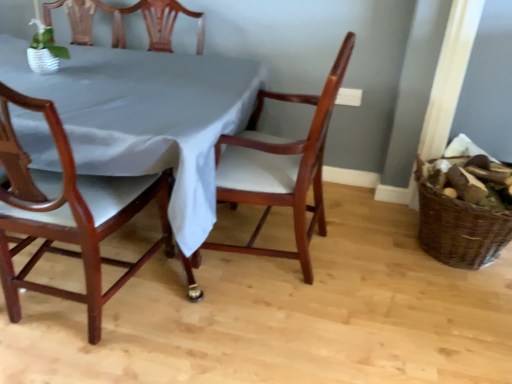
This screenshot has height=384, width=512. What do you see at coordinates (458, 227) in the screenshot? I see `brown woven basket at right` at bounding box center [458, 227].

Identify the location of brown woven basket at right. point(458,227).

Locate an element on the screen. chair that is behind the mahogany wood chair at left, positioned as the first chair in left-to-right order is located at coordinates (280, 167).

From a real-world perspective, is mahogany wood chair at left, the second chair in the right-to-left sequence, positioned above or below mahogany wood chair at center, the second chair when ordered from left to right?

In terms of real-world spatial position, mahogany wood chair at left, the second chair in the right-to-left sequence, is above mahogany wood chair at center, the second chair when ordered from left to right.

Is mahogany wood chair at left, positioned as the first chair in left-to-right order, looking in the opposite direction of mahogany wood chair at center, the 1th chair in the right-to-left sequence?

mahogany wood chair at left, positioned as the first chair in left-to-right order, is not turned away from mahogany wood chair at center, the 1th chair in the right-to-left sequence.

Considering the sizes of objects mahogany wood chair at left, positioned as the first chair in left-to-right order, and mahogany wood chair at center, the second chair when ordered from left to right, in the image provided, who is shorter, mahogany wood chair at left, positioned as the first chair in left-to-right order, or mahogany wood chair at center, the second chair when ordered from left to right,?

With less height is mahogany wood chair at center, the second chair when ordered from left to right.

Which is more to the left, satin white tablecloth at center or mahogany wood chair at center, the 1th chair in the right-to-left sequence?

satin white tablecloth at center is more to the left.

Is mahogany wood chair at center, the second chair when ordered from left to right, located within satin white tablecloth at center?

No.

Can you confirm if satin white tablecloth at center is bigger than mahogany wood chair at center, the second chair when ordered from left to right?

Indeed, satin white tablecloth at center has a larger size compared to mahogany wood chair at center, the second chair when ordered from left to right.

Considering the points (153, 142) and (264, 196), which point is behind, point (153, 142) or point (264, 196)?

Point (264, 196)

Is mahogany wood chair at center, the second chair when ordered from left to right, not near satin white tablecloth at center?

No, mahogany wood chair at center, the second chair when ordered from left to right, is not far from satin white tablecloth at center.

From a real-world perspective, is mahogany wood chair at center, the second chair when ordered from left to right, positioned above or below satin white tablecloth at center?

In terms of real-world spatial position, mahogany wood chair at center, the second chair when ordered from left to right, is above satin white tablecloth at center.

Does mahogany wood chair at center, the 1th chair in the right-to-left sequence, come in front of satin white tablecloth at center?

No, mahogany wood chair at center, the 1th chair in the right-to-left sequence, is further to the viewer.

From the image's perspective, which is above, mahogany wood chair at left, the second chair in the right-to-left sequence, or satin white tablecloth at center?

satin white tablecloth at center, from the image's perspective.

Which of these two, mahogany wood chair at left, the second chair in the right-to-left sequence, or satin white tablecloth at center, is wider?

satin white tablecloth at center.

Can you confirm if mahogany wood chair at left, the second chair in the right-to-left sequence, is positioned to the left of satin white tablecloth at center?

No.

Would you say mahogany wood chair at center, the 1th chair in the right-to-left sequence, is to the left or to the right of mahogany wood chair at left, positioned as the first chair in left-to-right order, in the picture?

mahogany wood chair at center, the 1th chair in the right-to-left sequence, is to the right of mahogany wood chair at left, positioned as the first chair in left-to-right order.

From the image's perspective, is mahogany wood chair at center, the 1th chair in the right-to-left sequence, under mahogany wood chair at left, positioned as the first chair in left-to-right order?

Actually, mahogany wood chair at center, the 1th chair in the right-to-left sequence, appears above mahogany wood chair at left, positioned as the first chair in left-to-right order, in the image.

How many degrees apart are the facing directions of mahogany wood chair at center, the 1th chair in the right-to-left sequence, and mahogany wood chair at left, positioned as the first chair in left-to-right order?

90 degrees separate the facing orientations of mahogany wood chair at center, the 1th chair in the right-to-left sequence, and mahogany wood chair at left, positioned as the first chair in left-to-right order.

Could you tell me if mahogany wood chair at center, the second chair when ordered from left to right, is turned towards mahogany wood chair at left, the second chair in the right-to-left sequence?

No.

How many degrees apart are the facing directions of satin white tablecloth at center and mahogany wood chair at left, the second chair in the right-to-left sequence?

There is a 179-degree angle between the facing directions of satin white tablecloth at center and mahogany wood chair at left, the second chair in the right-to-left sequence.

From the image's perspective, which one is positioned higher, satin white tablecloth at center or mahogany wood chair at left, the second chair in the right-to-left sequence?

From the image's view, satin white tablecloth at center is above.

Considering the points (150, 68) and (61, 126), which point is behind, point (150, 68) or point (61, 126)?

Positioned behind is point (150, 68).

Who is taller, satin white tablecloth at center or mahogany wood chair at left, the second chair in the right-to-left sequence?

With more height is mahogany wood chair at left, the second chair in the right-to-left sequence.

Does point (265, 253) lie behind point (505, 216)?

Yes.

Considering the relative sizes of mahogany wood chair at center, the second chair when ordered from left to right, and brown woven basket at right in the image provided, is mahogany wood chair at center, the second chair when ordered from left to right, thinner than brown woven basket at right?

No, mahogany wood chair at center, the second chair when ordered from left to right, is not thinner than brown woven basket at right.

Identify the location of the 1st chair directly above the brown woven basket at right (from a real-world perspective). The height and width of the screenshot is (384, 512). (280, 167).

Consider the image. Is mahogany wood chair at center, the 1th chair in the right-to-left sequence, taller than brown woven basket at right?

Yes, mahogany wood chair at center, the 1th chair in the right-to-left sequence, is taller than brown woven basket at right.

I want to click on chair in front of the mahogany wood chair at center, the 1th chair in the right-to-left sequence, so click(x=67, y=213).

Find the location of `the 1st chair positioned above the satin white tablecloth at center (from a real-world perspective)`. the 1st chair positioned above the satin white tablecloth at center (from a real-world perspective) is located at coordinates (280, 167).

Based on the photo, when comparing their distances from mahogany wood chair at left, the second chair in the right-to-left sequence, does mahogany wood chair at center, the 1th chair in the right-to-left sequence, or brown woven basket at right seem closer?

Based on the image, mahogany wood chair at center, the 1th chair in the right-to-left sequence, appears to be nearer to mahogany wood chair at left, the second chair in the right-to-left sequence.

From the image, which object appears to be farther from mahogany wood chair at center, the 1th chair in the right-to-left sequence, mahogany wood chair at left, positioned as the first chair in left-to-right order, or brown woven basket at right?

brown woven basket at right lies further to mahogany wood chair at center, the 1th chair in the right-to-left sequence, than the other object.

Estimate the real-world distances between objects in this image. Which object is further from brown woven basket at right, mahogany wood chair at left, the second chair in the right-to-left sequence, or mahogany wood chair at center, the second chair when ordered from left to right?

The object further to brown woven basket at right is mahogany wood chair at left, the second chair in the right-to-left sequence.

Based on their spatial positions, is mahogany wood chair at left, positioned as the first chair in left-to-right order, or mahogany wood chair at center, the second chair when ordered from left to right, further from satin white tablecloth at center?

mahogany wood chair at center, the second chair when ordered from left to right.

Estimate the real-world distances between objects in this image. Which object is closer to mahogany wood chair at left, positioned as the first chair in left-to-right order, satin white tablecloth at center or mahogany wood chair at center, the second chair when ordered from left to right?

satin white tablecloth at center.

From the image, which object appears to be farther from mahogany wood chair at left, positioned as the first chair in left-to-right order, mahogany wood chair at center, the second chair when ordered from left to right, or satin white tablecloth at center?

Among the two, mahogany wood chair at center, the second chair when ordered from left to right, is located further to mahogany wood chair at left, positioned as the first chair in left-to-right order.

From the image, which object appears to be nearer to mahogany wood chair at left, the second chair in the right-to-left sequence, satin white tablecloth at center or brown woven basket at right?

Among the two, satin white tablecloth at center is located nearer to mahogany wood chair at left, the second chair in the right-to-left sequence.

Based on their spatial positions, is mahogany wood chair at center, the 1th chair in the right-to-left sequence, or satin white tablecloth at center closer to brown woven basket at right?

mahogany wood chair at center, the 1th chair in the right-to-left sequence, lies closer to brown woven basket at right than the other object.

The image size is (512, 384). Find the location of `chair situated between satin white tablecloth at center and mahogany wood chair at center, the 1th chair in the right-to-left sequence, from left to right`. chair situated between satin white tablecloth at center and mahogany wood chair at center, the 1th chair in the right-to-left sequence, from left to right is located at coordinates (67, 213).

Find the location of a particular element. chair between mahogany wood chair at left, positioned as the first chair in left-to-right order, and brown woven basket at right, in the horizontal direction is located at coordinates (280, 167).